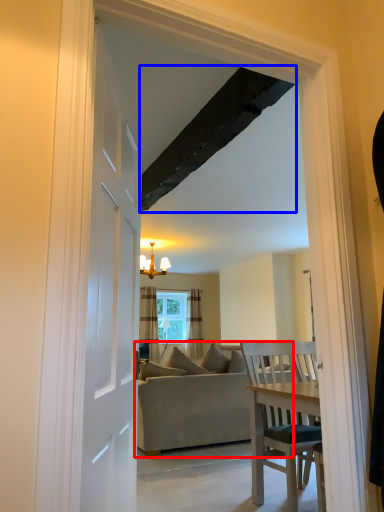
Question: Which object is further to the camera taking this photo, studio couch (highlighted by a red box) or exhaust hood (highlighted by a blue box)?

Choices:
 (A) studio couch
 (B) exhaust hood

Answer: (A)